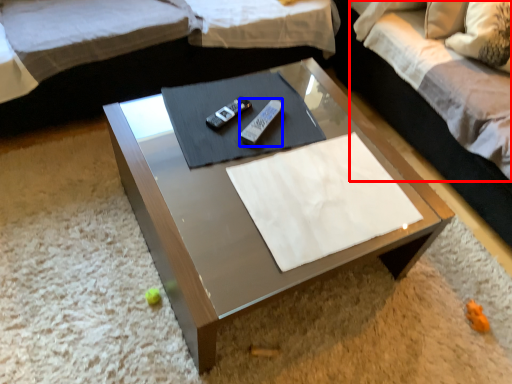
Question: Which object is closer to the camera taking this photo, bedding (highlighted by a red box) or remote (highlighted by a blue box)?

Choices:
 (A) bedding
 (B) remote

Answer: (A)